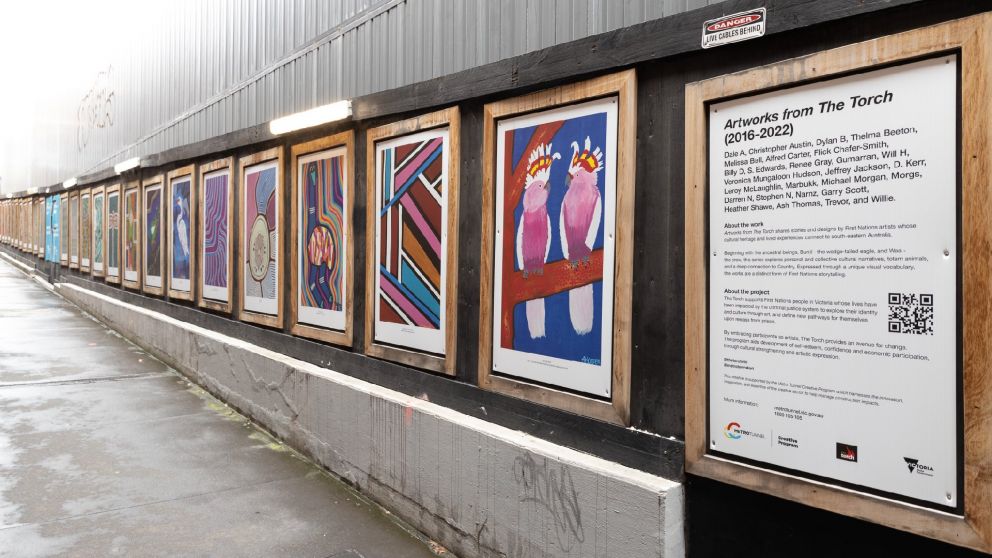
I want to click on wall, so click(x=357, y=445).